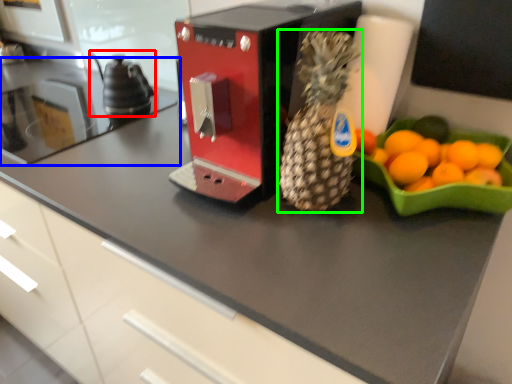
Question: Which object is positioned closest to tea pot (highlighted by a red box)? Select from countertop (highlighted by a blue box) and pineapple (highlighted by a green box).

Choices:
 (A) countertop
 (B) pineapple

Answer: (A)